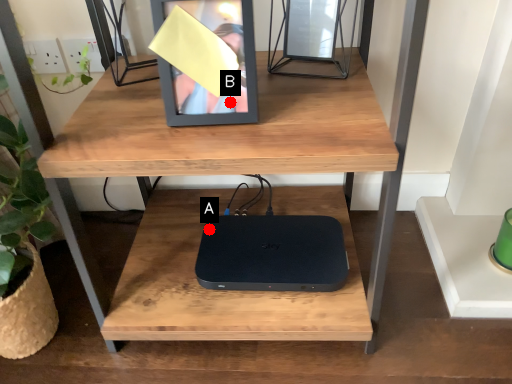
Question: Two points are circled on the image, labeled by A and B beside each circle. Among these points, which one is nearest to the camera?

Choices:
 (A) A is closer
 (B) B is closer

Answer: (B)